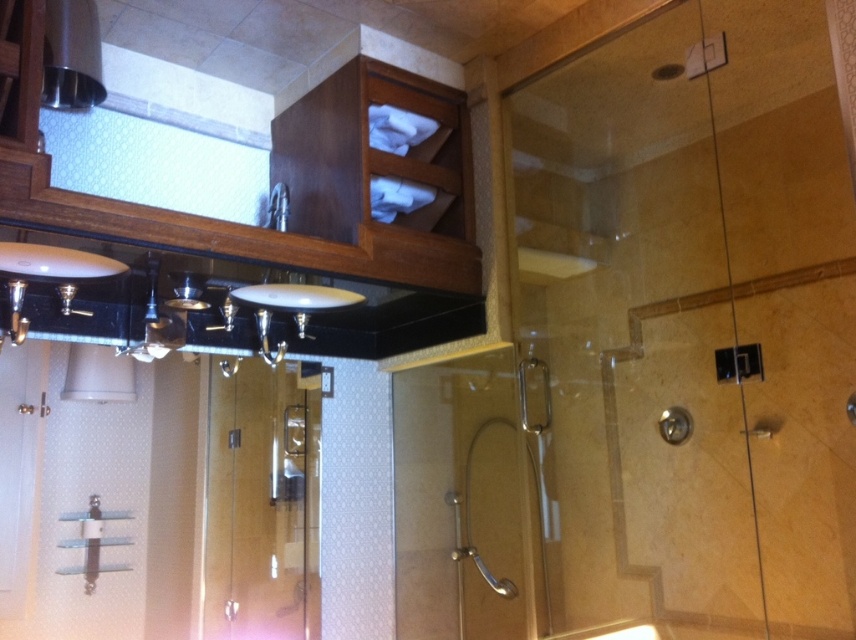
Question: Estimate the real-world distances between objects in this image. Which object is farther from the clear glass shower door at center?

Choices:
 (A) white glossy sink at center
 (B) transparent glass shower door at center
 (C) satin nickel faucet at upper center

Answer: (C)

Question: Does transparent glass shower door at center have a larger size compared to white glossy sink at center?

Choices:
 (A) no
 (B) yes

Answer: (B)

Question: Which of the following is the closest to the observer?

Choices:
 (A) clear glass shower door at center
 (B) white glossy sink at center
 (C) satin nickel faucet at upper center

Answer: (B)

Question: Which is farther from the transparent glass shower door at center?

Choices:
 (A) white glossy sink at center
 (B) clear glass shower door at center
 (C) satin nickel faucet at upper center

Answer: (C)

Question: Is transparent glass shower door at center below white glossy sink at center?

Choices:
 (A) no
 (B) yes

Answer: (B)

Question: Does white glossy sink at center lie behind satin nickel faucet at upper center?

Choices:
 (A) no
 (B) yes

Answer: (A)